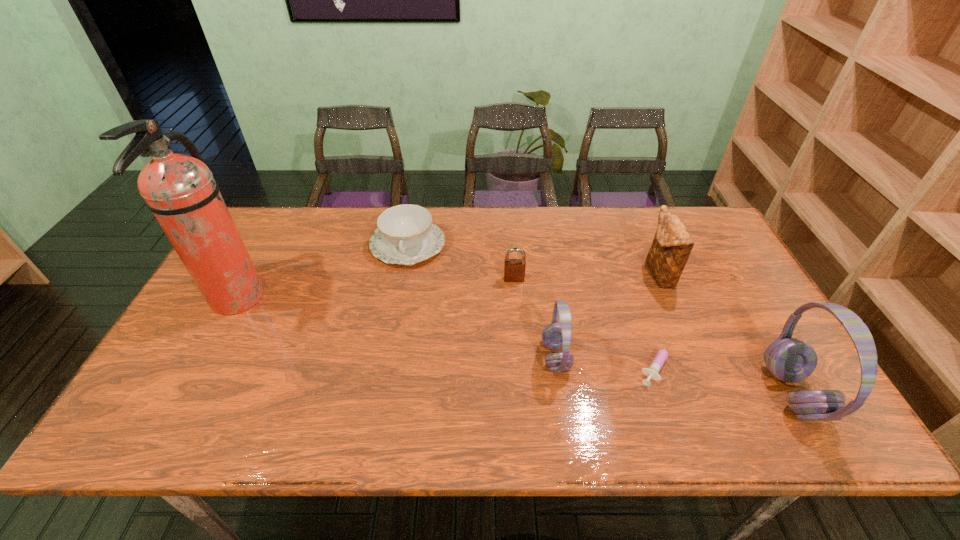
Where is `the left headset`? the left headset is located at coordinates (556, 336).

At what (x,y) coordinates should I click in order to perform the action: click on the shorter headset. Please return your answer as a coordinate pair (x, y). The height and width of the screenshot is (540, 960). Looking at the image, I should click on (556, 336).

Locate an element on the screen. the taller headset is located at coordinates (791, 360).

I want to click on the sixth shortest object, so click(x=791, y=360).

You are a GUI agent. You are given a task and a screenshot of the screen. Output one action in this format:
    pyautogui.click(x=<x>, y=<y>)
    Task: Click on the clutch bag
    
    Given the screenshot: What is the action you would take?
    pyautogui.click(x=672, y=244)

This screenshot has height=540, width=960. Find the location of `the second shortest object`. the second shortest object is located at coordinates (406, 235).

Locate an element on the screen. the second object from left to right is located at coordinates (406, 235).

Where is `the fifth tallest object`? This screenshot has width=960, height=540. the fifth tallest object is located at coordinates (514, 269).

At what (x,y) coordinates should I click in order to perform the action: click on padlock. Please return your answer as a coordinate pair (x, y). Image resolution: width=960 pixels, height=540 pixels. Looking at the image, I should click on (514, 269).

Locate an element on the screen. fire extinguisher is located at coordinates (180, 190).